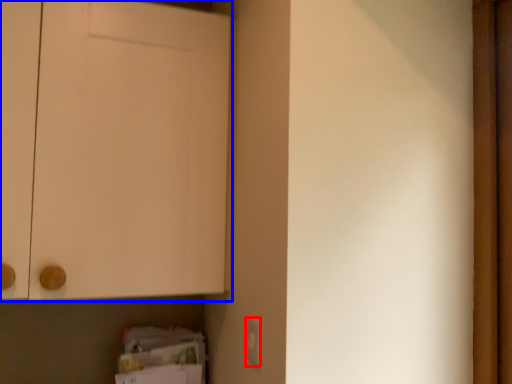
Question: Which of the following is the closest to the observer, electric outlet (highlighted by a red box) or door (highlighted by a blue box)?

Choices:
 (A) electric outlet
 (B) door

Answer: (A)